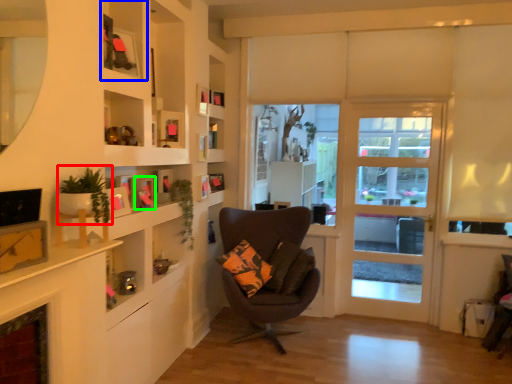
Question: Which object is positioned farthest from plant (highlighted by a red box)? Select from shelf (highlighted by a blue box) and picture frame (highlighted by a green box).

Choices:
 (A) shelf
 (B) picture frame

Answer: (B)